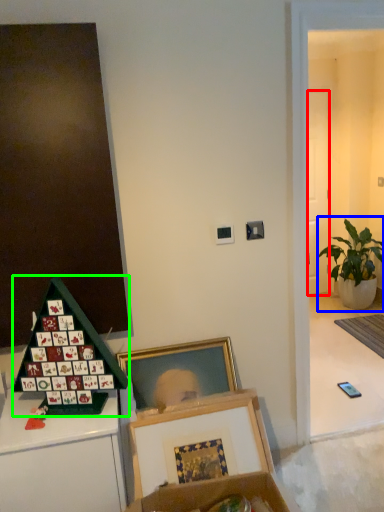
Question: Which is farther away from door (highlighted by a red box)? houseplant (highlighted by a blue box) or toy (highlighted by a green box)?

Choices:
 (A) houseplant
 (B) toy

Answer: (B)